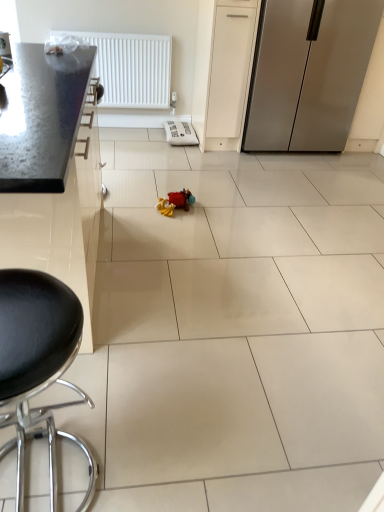
Question: Does metallic countertop at left have a greater width compared to soft plush toy at center?

Choices:
 (A) yes
 (B) no

Answer: (A)

Question: Is metallic countertop at left with soft plush toy at center?

Choices:
 (A) yes
 (B) no

Answer: (B)

Question: Would you say metallic countertop at left is a long distance from soft plush toy at center?

Choices:
 (A) no
 (B) yes

Answer: (A)

Question: Does metallic countertop at left come behind soft plush toy at center?

Choices:
 (A) no
 (B) yes

Answer: (A)

Question: Is metallic countertop at left outside of soft plush toy at center?

Choices:
 (A) yes
 (B) no

Answer: (A)

Question: Would you say soft plush toy at center is to the left or to the right of metallic countertop at left in the picture?

Choices:
 (A) left
 (B) right

Answer: (B)

Question: From a real-world perspective, is soft plush toy at center physically located above or below metallic countertop at left?

Choices:
 (A) above
 (B) below

Answer: (B)

Question: Considering the positions of soft plush toy at center and metallic countertop at left in the image, is soft plush toy at center bigger or smaller than metallic countertop at left?

Choices:
 (A) big
 (B) small

Answer: (B)

Question: From the image's perspective, is soft plush toy at center located above or below metallic countertop at left?

Choices:
 (A) above
 (B) below

Answer: (A)

Question: From the image's perspective, relative to black leather stool at lower left, is white plastic radiator at upper left above or below?

Choices:
 (A) above
 (B) below

Answer: (A)

Question: Is white plastic radiator at upper left to the left or to the right of black leather stool at lower left in the image?

Choices:
 (A) left
 (B) right

Answer: (A)

Question: From a real-world perspective, is white plastic radiator at upper left above or below black leather stool at lower left?

Choices:
 (A) below
 (B) above

Answer: (B)

Question: Relative to black leather stool at lower left, is white plastic radiator at upper left in front or behind?

Choices:
 (A) front
 (B) behind

Answer: (B)

Question: Is satin silver refrigerator at right bigger or smaller than soft plush toy at center?

Choices:
 (A) big
 (B) small

Answer: (A)

Question: Is satin silver refrigerator at right inside or outside of soft plush toy at center?

Choices:
 (A) outside
 (B) inside

Answer: (A)